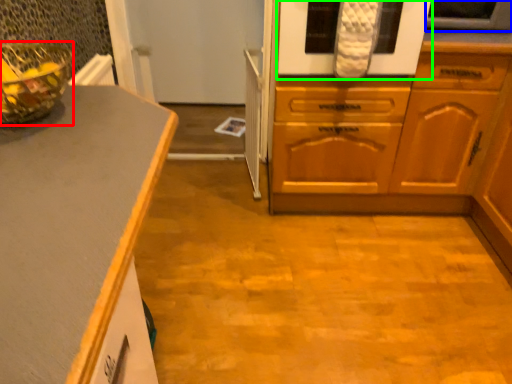
Question: Estimate the real-world distances between objects in this image. Which object is closer to glass bowl (highlighted by a red box), appliance (highlighted by a blue box) or oven (highlighted by a green box)?

Choices:
 (A) appliance
 (B) oven

Answer: (B)